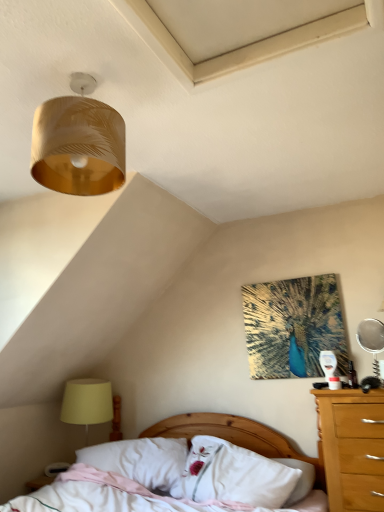
Question: From a real-world perspective, is white soft pillow at center, positioned as the 2th pillow in left-to-right order, under silver metallic mirror at right?

Choices:
 (A) yes
 (B) no

Answer: (A)

Question: Can you confirm if white soft pillow at center, positioned as the 2th pillow in left-to-right order, is positioned to the left of silver metallic mirror at right?

Choices:
 (A) yes
 (B) no

Answer: (A)

Question: From a real-world perspective, is white soft pillow at center, which is the 1th pillow in right-to-left order, positioned over silver metallic mirror at right based on gravity?

Choices:
 (A) no
 (B) yes

Answer: (A)

Question: Is white soft pillow at center, positioned as the 2th pillow in left-to-right order, outside of silver metallic mirror at right?

Choices:
 (A) yes
 (B) no

Answer: (A)

Question: Does white soft pillow at center, positioned as the 2th pillow in left-to-right order, have a greater height compared to silver metallic mirror at right?

Choices:
 (A) no
 (B) yes

Answer: (B)

Question: Looking at their shapes, would you say wooden bed at lower center is wider or thinner than gold textured lampshade at upper left?

Choices:
 (A) wide
 (B) thin

Answer: (A)

Question: Based on their positions, is wooden bed at lower center located to the left or right of gold textured lampshade at upper left?

Choices:
 (A) right
 (B) left

Answer: (A)

Question: Would you say wooden bed at lower center is inside or outside gold textured lampshade at upper left?

Choices:
 (A) inside
 (B) outside

Answer: (B)

Question: Is point (284, 444) positioned closer to the camera than point (34, 143)?

Choices:
 (A) farther
 (B) closer

Answer: (A)

Question: Is yellow fabric lampshade at lower left spatially inside silver metallic mirror at right, or outside of it?

Choices:
 (A) outside
 (B) inside

Answer: (A)

Question: From their relative heights in the image, would you say yellow fabric lampshade at lower left is taller or shorter than silver metallic mirror at right?

Choices:
 (A) tall
 (B) short

Answer: (A)

Question: Is yellow fabric lampshade at lower left wider or thinner than silver metallic mirror at right?

Choices:
 (A) thin
 (B) wide

Answer: (B)

Question: In the image, is yellow fabric lampshade at lower left positioned in front of or behind silver metallic mirror at right?

Choices:
 (A) behind
 (B) front

Answer: (A)

Question: From the image's perspective, is gold textured lampshade at upper left located above or below white soft pillow at center, which is the 1th pillow in right-to-left order?

Choices:
 (A) below
 (B) above

Answer: (B)

Question: Considering the relative positions of gold textured lampshade at upper left and white soft pillow at center, positioned as the 2th pillow in left-to-right order, in the image provided, is gold textured lampshade at upper left to the left or to the right of white soft pillow at center, positioned as the 2th pillow in left-to-right order,?

Choices:
 (A) left
 (B) right

Answer: (A)